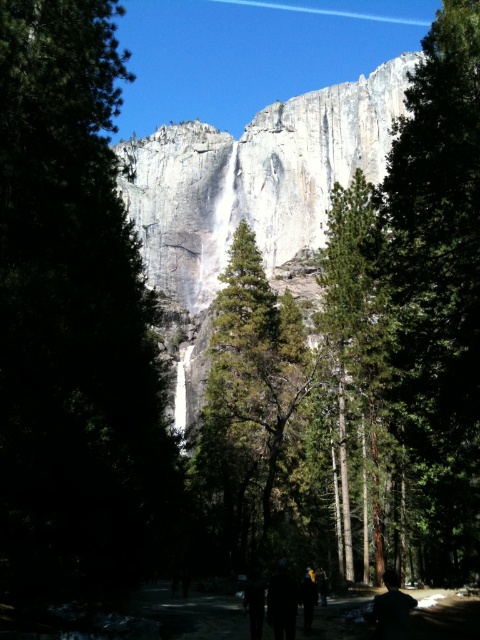
What is the spatial relationship between the green textured tree at left and the green matte tree at center?

The green textured tree at left is positioned to the left of the green matte tree at center.

You are a hiker trying to determine which tree to climb for a better view. The green matte tree at center and the green rough bark tree at center are both in your path. Which tree is taller?

The green matte tree at center is taller than the green rough bark tree at center.